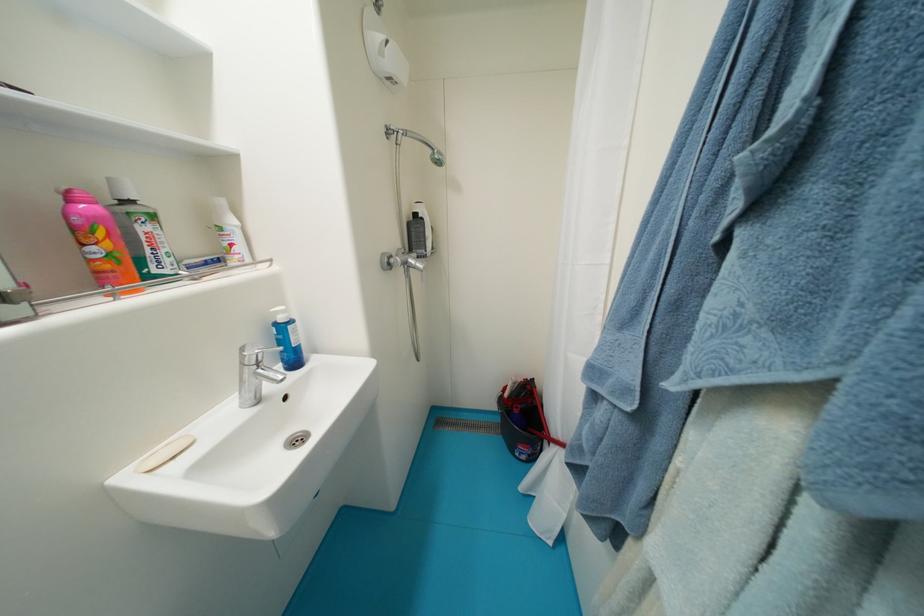
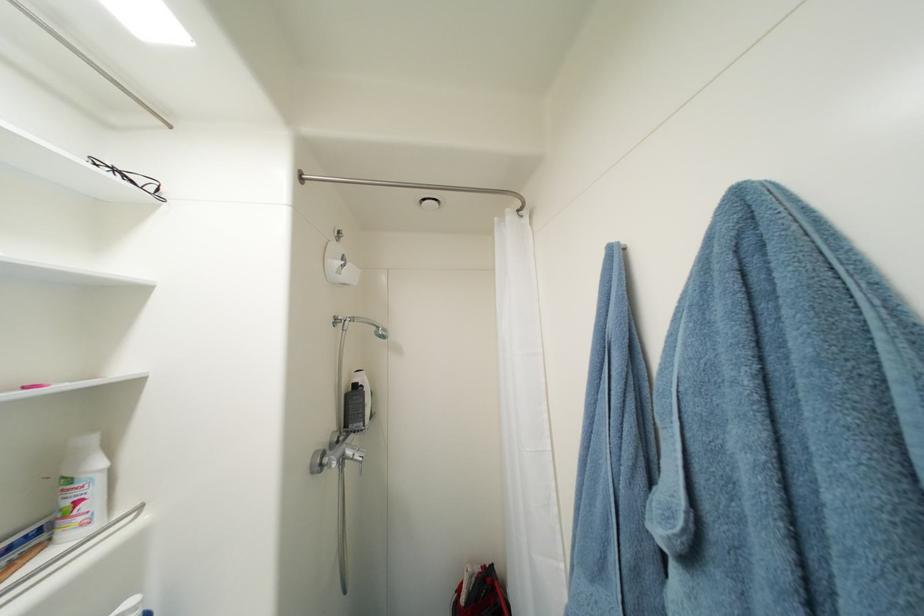
The point at (513, 397) is marked in the first image. Where is the corresponding point in the second image?

(469, 602)